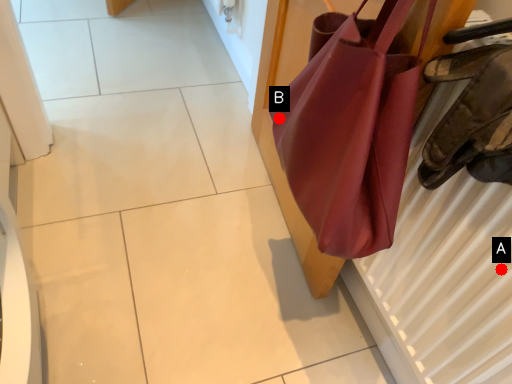
Question: Two points are circled on the image, labeled by A and B beside each circle. Which of the following is the closest to the observer?

Choices:
 (A) A is closer
 (B) B is closer

Answer: (A)